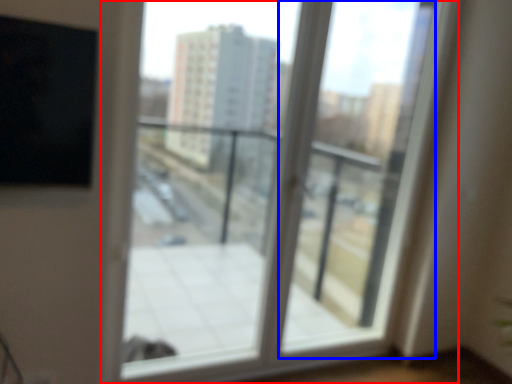
Question: Which object is closer to the camera taking this photo, window (highlighted by a red box) or screen door (highlighted by a blue box)?

Choices:
 (A) window
 (B) screen door

Answer: (A)